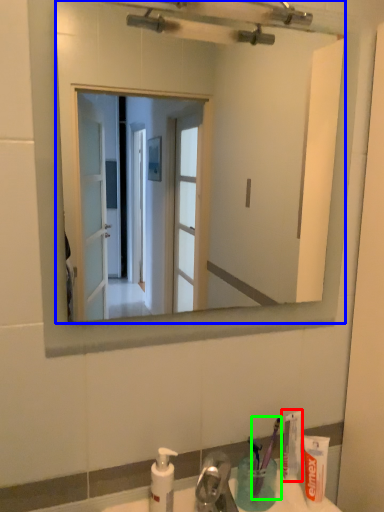
Question: Which is farther away from toothpaste (highlighted by a red box)? mirror (highlighted by a blue box) or toothbrush (highlighted by a green box)?

Choices:
 (A) mirror
 (B) toothbrush

Answer: (A)